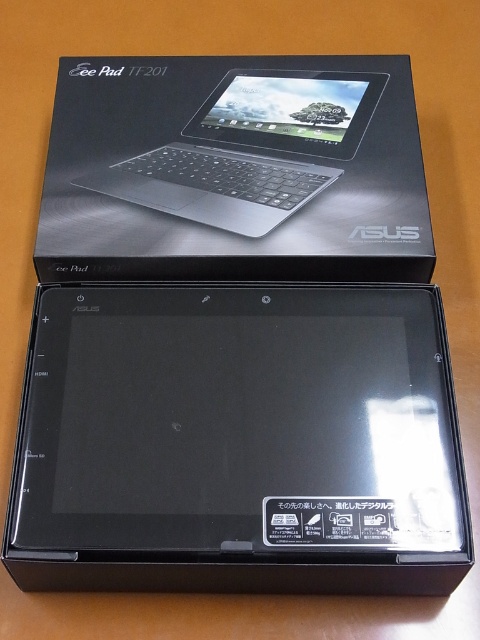
Question: Which point is closer to the camera?

Choices:
 (A) satin black laptop at upper center
 (B) black glossy tablet at center

Answer: (B)

Question: Is black glossy tablet at center positioned at the back of satin black laptop at upper center?

Choices:
 (A) yes
 (B) no

Answer: (B)

Question: Can you confirm if black glossy tablet at center is wider than satin black laptop at upper center?

Choices:
 (A) no
 (B) yes

Answer: (B)

Question: Which point is farther to the camera?

Choices:
 (A) (327, 513)
 (B) (307, 115)

Answer: (B)

Question: Does black glossy tablet at center lie in front of satin black laptop at upper center?

Choices:
 (A) no
 (B) yes

Answer: (B)